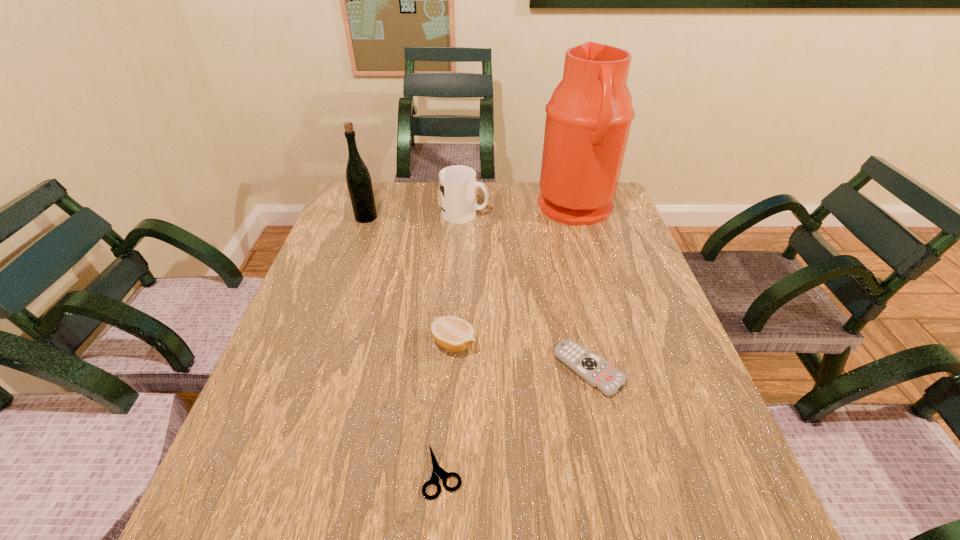
Locate an element on the screen. empty location between the beer bottle and the shortest object is located at coordinates (404, 344).

Where is `free area in between the shortest object and the tallest object`? free area in between the shortest object and the tallest object is located at coordinates (510, 340).

Select which object is the second closest to the beer bottle. Please provide its 2D coordinates. Your answer should be formatted as a tuple, i.e. [(x, y)], where the tuple contains the x and y coordinates of a point satisfying the conditions above.

[(454, 334)]

Identify which object is the second nearest to the tallest object. Please provide its 2D coordinates. Your answer should be formatted as a tuple, i.e. [(x, y)], where the tuple contains the x and y coordinates of a point satisfying the conditions above.

[(597, 372)]

The width and height of the screenshot is (960, 540). Find the location of `free location that satisfies the following two spatial constraints: 1. on the back side of the shears; 2. on the left side of the fourth tallest object`. free location that satisfies the following two spatial constraints: 1. on the back side of the shears; 2. on the left side of the fourth tallest object is located at coordinates (451, 343).

You are a GUI agent. You are given a task and a screenshot of the screen. Output one action in this format:
    pyautogui.click(x=<x>, y=<y>)
    Task: Click on the vacant position in the image that satisfies the following two spatial constraints: 1. on the back side of the second shortest object; 2. on the handle side of the fourth shortest object
    The width and height of the screenshot is (960, 540).
    Given the screenshot: What is the action you would take?
    pyautogui.click(x=554, y=214)

Locate an element on the screen. Image resolution: width=960 pixels, height=540 pixels. free space that satisfies the following two spatial constraints: 1. on the front side of the beer bottle; 2. on the right side of the shears is located at coordinates (277, 471).